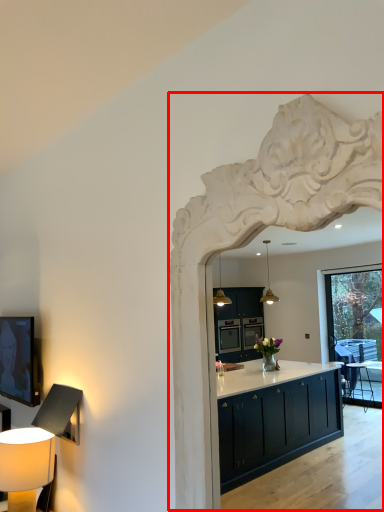
Question: From the image's perspective, where is archway (annotated by the red box) located relative to table lamp?

Choices:
 (A) below
 (B) above

Answer: (B)